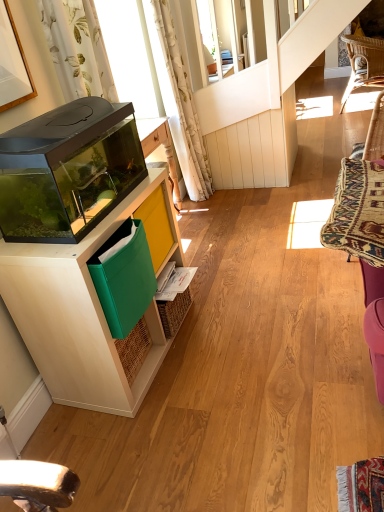
Question: From the image's perspective, is green fabric folder at lower left located above or below transparent glass aquarium at left?

Choices:
 (A) below
 (B) above

Answer: (A)

Question: Based on their sizes in the image, would you say green fabric folder at lower left is bigger or smaller than transparent glass aquarium at left?

Choices:
 (A) big
 (B) small

Answer: (B)

Question: Which object is the farthest from the white floral fabric curtain at upper left, arranged as the 1th curtain when viewed from the left?

Choices:
 (A) woven rattan chair at upper right
 (B) white floral fabric curtain at upper center, arranged as the second curtain when viewed from the left
 (C) green fabric folder at lower left
 (D) woven wicker swivel chair at right
 (E) transparent glass aquarium at left

Answer: (A)

Question: Estimate the real-world distances between objects in this image. Which object is closer to the woven rattan chair at upper right?

Choices:
 (A) transparent glass aquarium at left
 (B) white floral fabric curtain at upper center, the 1th curtain viewed from the back
 (C) white wood cabinet at left
 (D) white floral fabric curtain at upper left, arranged as the 1th curtain when viewed from the left
 (E) green fabric folder at lower left

Answer: (B)